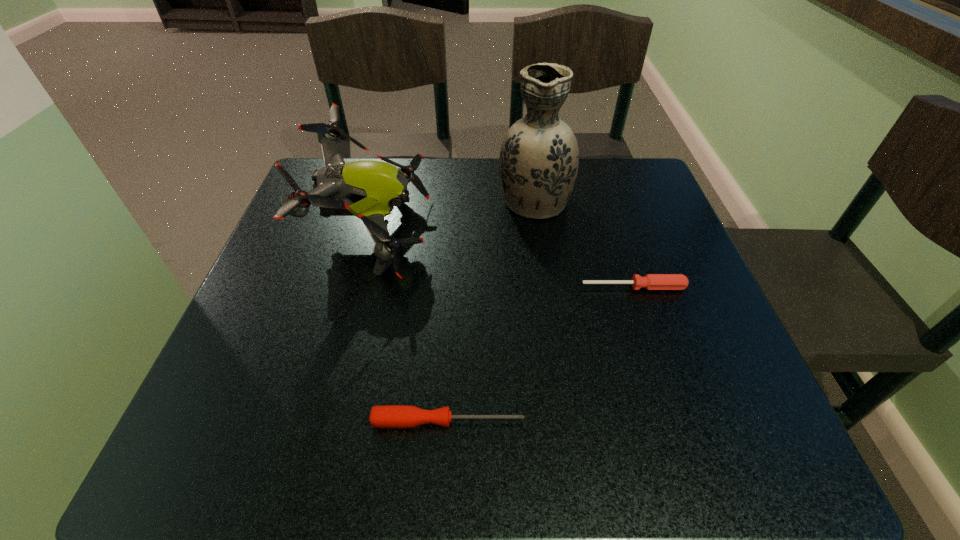
This screenshot has width=960, height=540. What are the coordinates of `vacant space in between the drone and the left screwdriver` in the screenshot? It's located at (411, 327).

You are a GUI agent. You are given a task and a screenshot of the screen. Output one action in this format:
    pyautogui.click(x=<x>, y=<y>)
    Task: Click on the unoccupied position between the nearer screwdriver and the tallest object
    The height and width of the screenshot is (540, 960).
    Given the screenshot: What is the action you would take?
    pyautogui.click(x=492, y=310)

This screenshot has height=540, width=960. Find the location of `vacant area that lies between the vase and the nearest object`. vacant area that lies between the vase and the nearest object is located at coordinates (492, 310).

Find the location of a particular element. object that is the closest to the farther screwdriver is located at coordinates (539, 158).

Identify which object is located as the nearest to the drone. Please provide its 2D coordinates. Your answer should be formatted as a tuple, i.e. [(x, y)], where the tuple contains the x and y coordinates of a point satisfying the conditions above.

[(539, 158)]

Where is `free spot that satisfies the following two spatial constraints: 1. on the front-facing side of the second tallest object; 2. on the right side of the right screwdriver`? free spot that satisfies the following two spatial constraints: 1. on the front-facing side of the second tallest object; 2. on the right side of the right screwdriver is located at coordinates (359, 287).

You are a GUI agent. You are given a task and a screenshot of the screen. Output one action in this format:
    pyautogui.click(x=<x>, y=<y>)
    Task: Click on the vacant area that satisfies the following two spatial constraints: 1. on the back side of the farther screwdriver; 2. on the front-facing side of the drone
    Image resolution: width=960 pixels, height=540 pixels.
    Given the screenshot: What is the action you would take?
    pyautogui.click(x=615, y=233)

Where is `free location that satisfies the following two spatial constraints: 1. on the front-facing side of the farther screwdriver; 2. on the left side of the second tallest object`? The width and height of the screenshot is (960, 540). free location that satisfies the following two spatial constraints: 1. on the front-facing side of the farther screwdriver; 2. on the left side of the second tallest object is located at coordinates (359, 287).

Find the location of `free space that satisfies the following two spatial constraints: 1. on the front-facing side of the second tallest object; 2. on the back side of the right screwdriver`. free space that satisfies the following two spatial constraints: 1. on the front-facing side of the second tallest object; 2. on the back side of the right screwdriver is located at coordinates (359, 287).